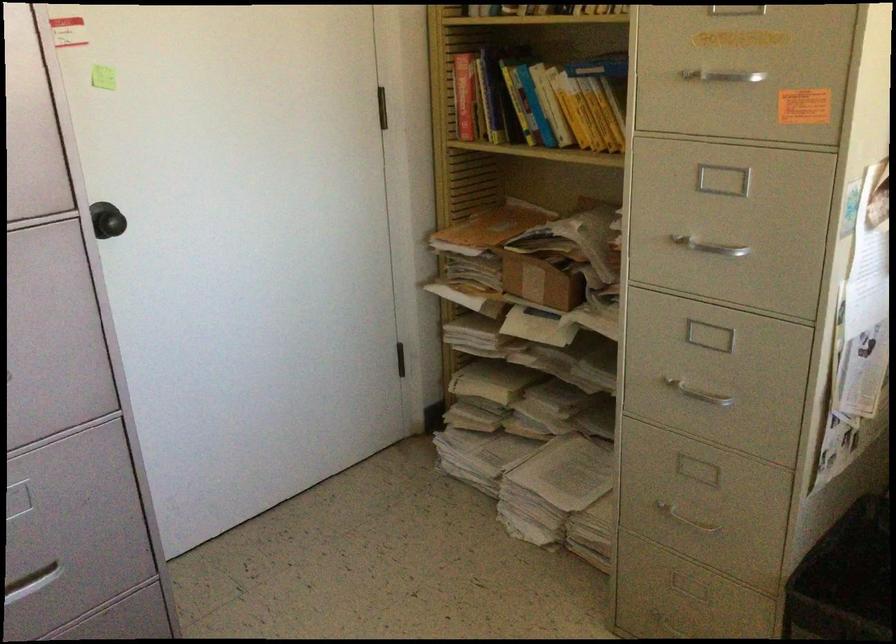
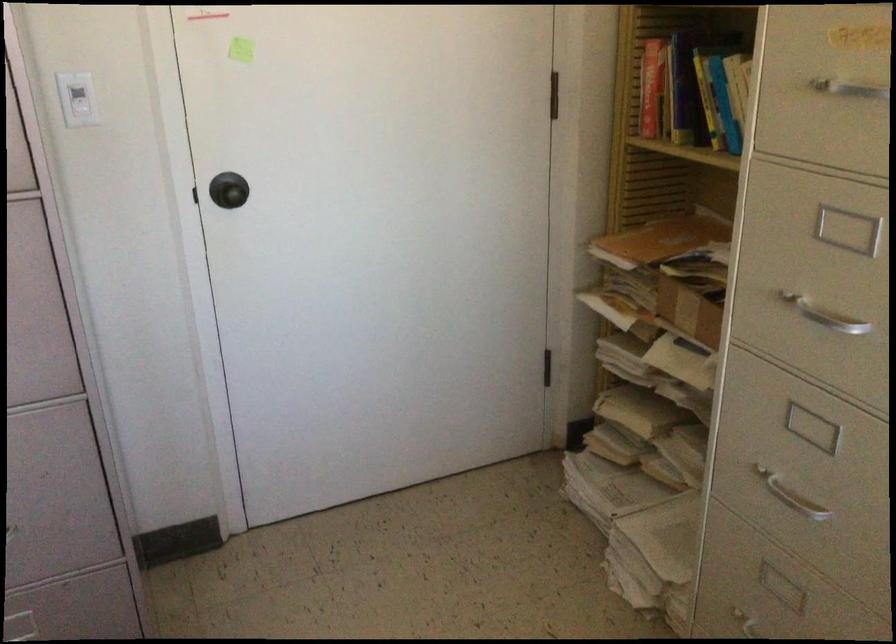
Question: The camera is either moving clockwise (left) or counter-clockwise (right) around the object. The first image is from the beginning of the video and the second image is from the end. Is the camera moving left or right when shooting the video?

Choices:
 (A) Left
 (B) Right

Answer: (B)